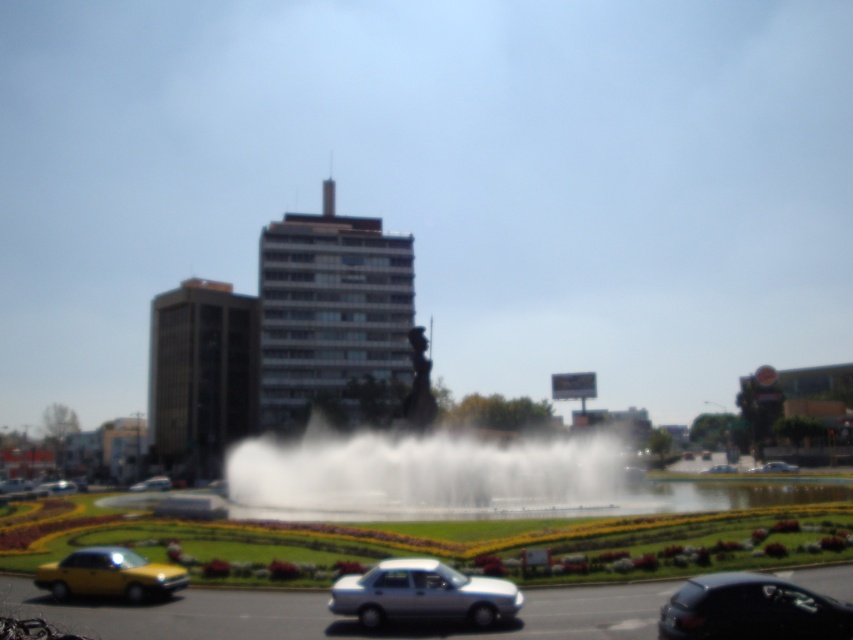
You are standing at the center of the image and want to walk towards the white mist at center. Which direction should you move to reach it?

Since you are already at the center of the image, you are already at the location of the white mist at center.

Looking at this image, you are standing in the urban scene and want to take a photo of both point (837, 600) and point (788, 472). Which point should you focus on first to ensure both are in clear view?

Point (837, 600) is closer to the camera than point (788, 472), so you should focus on point (837, 600) first to ensure both are in clear view.